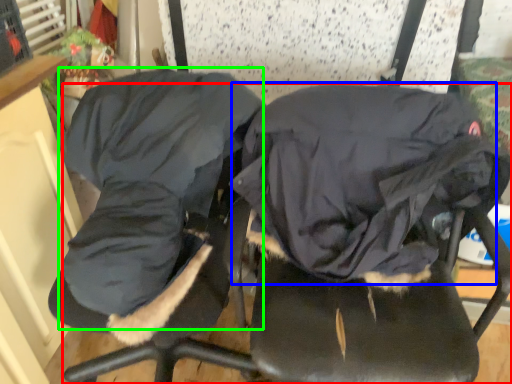
Question: Which object is positioned farthest from chair (highlighted by a red box)? Select from sleeping bag (highlighted by a blue box) and clothing (highlighted by a green box).

Choices:
 (A) sleeping bag
 (B) clothing

Answer: (B)